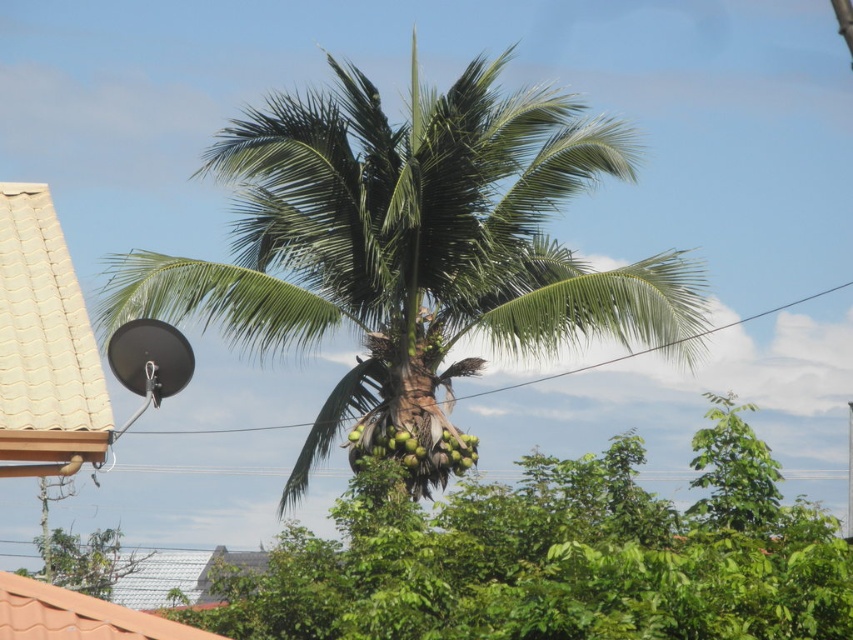
Does green leafy coconut tree at center have a lesser width compared to green coconut at center?

Incorrect, green leafy coconut tree at center's width is not less than green coconut at center's.

The image size is (853, 640). I want to click on green leafy coconut tree at center, so pyautogui.click(x=409, y=243).

Looking at this image, does green leafy coconut tree at center appear on the left side of green leafy palm tree at center?

Yes, green leafy coconut tree at center is to the left of green leafy palm tree at center.

Can you confirm if green leafy coconut tree at center is positioned to the right of green leafy palm tree at center?

Incorrect, green leafy coconut tree at center is not on the right side of green leafy palm tree at center.

Locate an element on the screen. This screenshot has height=640, width=853. green leafy coconut tree at center is located at coordinates (409, 243).

Who is higher up, green leafy palm tree at center or green coconut at center?

green coconut at center is above.

What do you see at coordinates (558, 557) in the screenshot? This screenshot has height=640, width=853. I see `green leafy palm tree at center` at bounding box center [558, 557].

What do you see at coordinates (558, 557) in the screenshot? I see `green leafy palm tree at center` at bounding box center [558, 557].

At what (x,y) coordinates should I click in order to perform the action: click on green leafy palm tree at center. Please return your answer as a coordinate pair (x, y). Looking at the image, I should click on (558, 557).